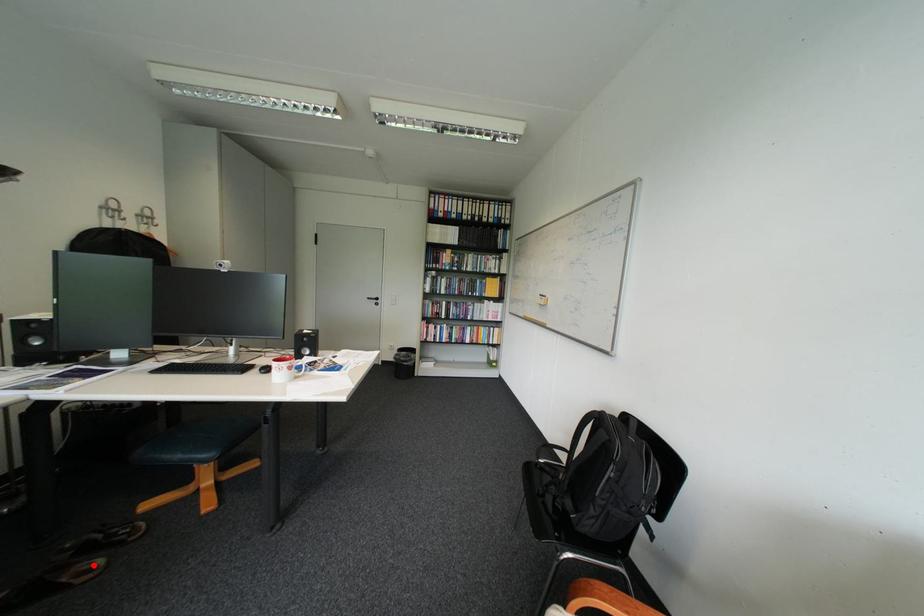
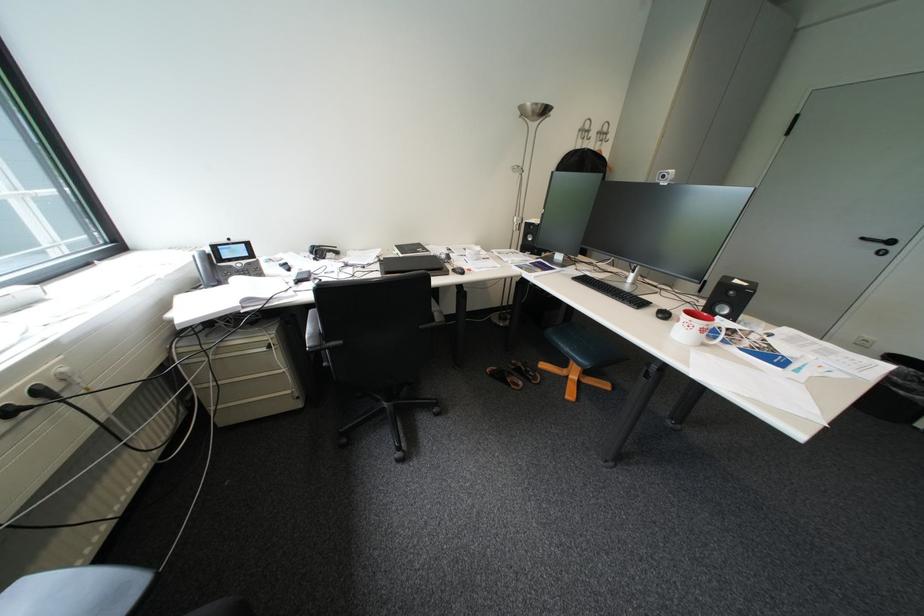
The point at the highlighted location is marked in the first image. Where is the corresponding point in the second image?

(527, 379)